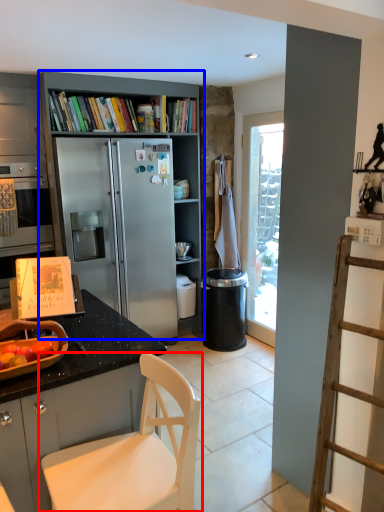
Question: Which point is closer to the camera, chair (highlighted by a red box) or bookcase (highlighted by a blue box)?

Choices:
 (A) chair
 (B) bookcase

Answer: (A)